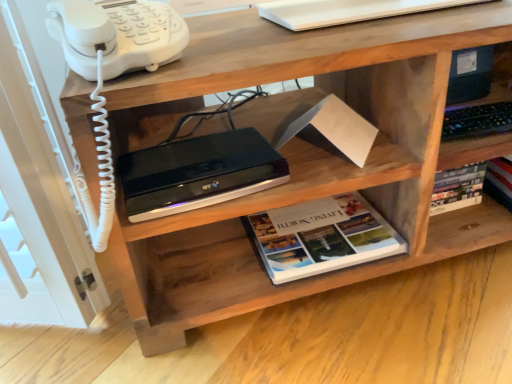
Question: Can you confirm if white plastic phone at upper left is shorter than hardcover book at center?

Choices:
 (A) yes
 (B) no

Answer: (B)

Question: From a real-world perspective, is white plastic phone at upper left beneath hardcover book at center?

Choices:
 (A) yes
 (B) no

Answer: (B)

Question: Does white plastic phone at upper left contain hardcover book at center?

Choices:
 (A) no
 (B) yes

Answer: (A)

Question: From the image's perspective, is white plastic phone at upper left below hardcover book at center?

Choices:
 (A) no
 (B) yes

Answer: (A)

Question: From a real-world perspective, is white plastic phone at upper left physically above hardcover book at center?

Choices:
 (A) yes
 (B) no

Answer: (A)

Question: Can you confirm if white plastic phone at upper left is wider than hardcover book at center?

Choices:
 (A) no
 (B) yes

Answer: (A)

Question: Considering the relative sizes of hardcover book at center and black plastic printer at upper center in the image provided, is hardcover book at center thinner than black plastic printer at upper center?

Choices:
 (A) no
 (B) yes

Answer: (A)

Question: Is hardcover book at center looking in the opposite direction of black plastic printer at upper center?

Choices:
 (A) no
 (B) yes

Answer: (A)

Question: Is hardcover book at center with black plastic printer at upper center?

Choices:
 (A) yes
 (B) no

Answer: (B)

Question: From the image's perspective, is hardcover book at center located above black plastic printer at upper center?

Choices:
 (A) no
 (B) yes

Answer: (A)

Question: Is the depth of hardcover book at center less than that of black plastic printer at upper center?

Choices:
 (A) yes
 (B) no

Answer: (B)

Question: Considering the relative sizes of hardcover book at center and black plastic printer at upper center in the image provided, is hardcover book at center smaller than black plastic printer at upper center?

Choices:
 (A) yes
 (B) no

Answer: (B)

Question: Is white plastic phone at upper left at the left side of black plastic printer at upper center?

Choices:
 (A) yes
 (B) no

Answer: (A)